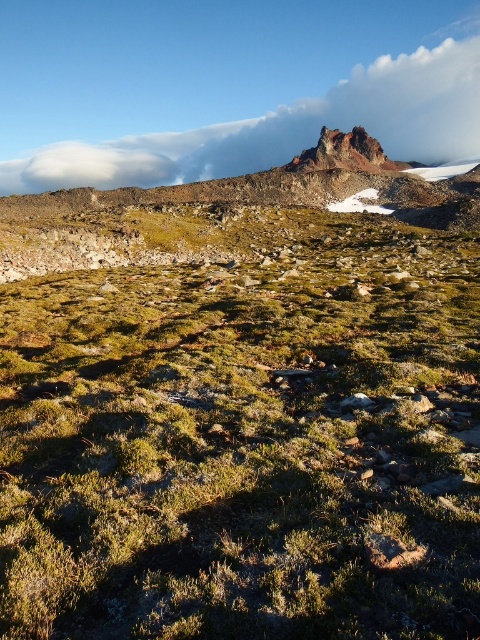
Question: Considering the relative positions of white fluffy cloud at upper center and rugged rock peak at upper center in the image provided, where is white fluffy cloud at upper center located with respect to rugged rock peak at upper center?

Choices:
 (A) left
 (B) right

Answer: (B)

Question: Among these points, which one is nearest to the camera?

Choices:
 (A) (359, 152)
 (B) (146, 172)

Answer: (A)

Question: Which point is closer to the camera?

Choices:
 (A) white fluffy cloud at upper center
 (B) rugged rock peak at upper center

Answer: (B)

Question: Can you confirm if white fluffy cloud at upper center is positioned above rugged rock peak at upper center?

Choices:
 (A) yes
 (B) no

Answer: (A)

Question: Does white fluffy cloud at upper center appear under rugged rock peak at upper center?

Choices:
 (A) no
 (B) yes

Answer: (A)